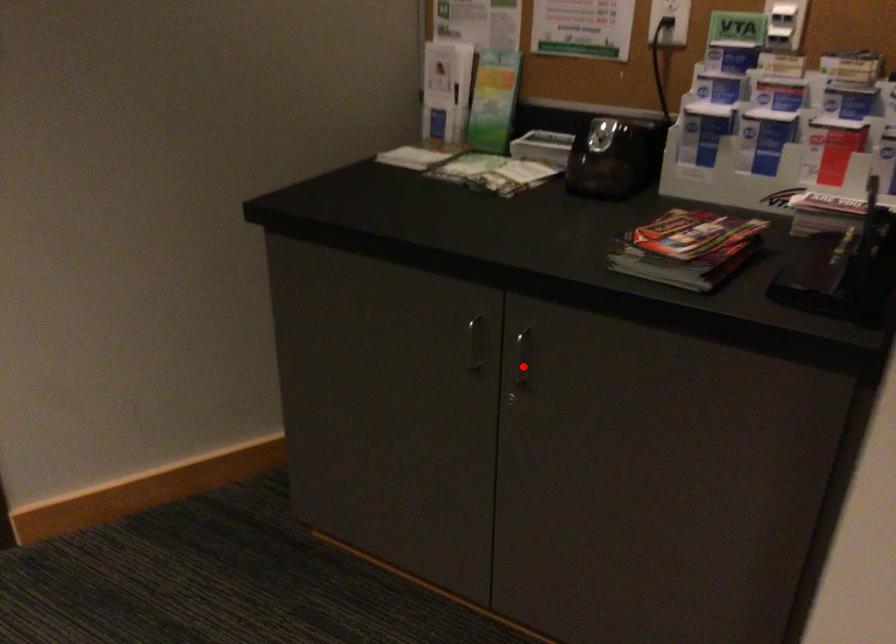
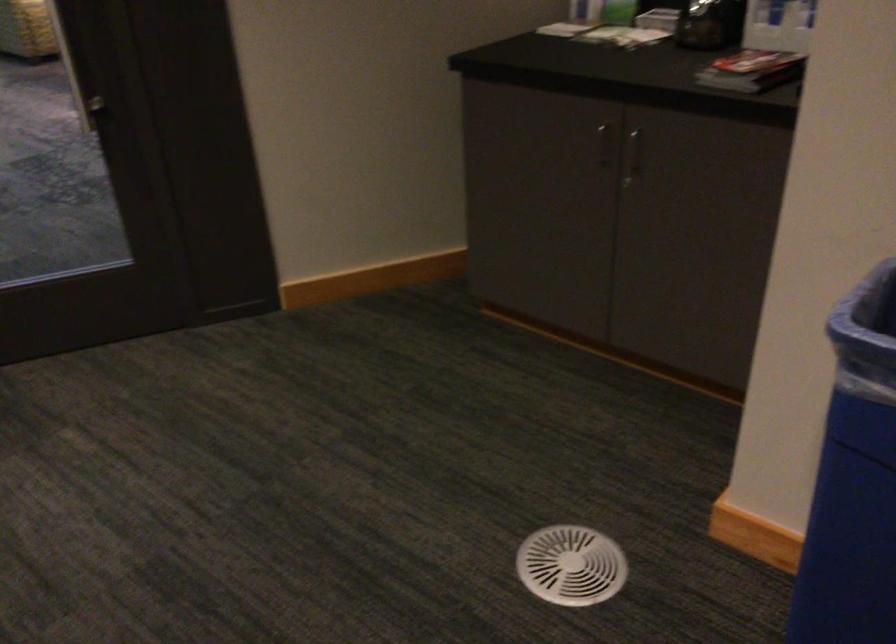
Question: A red point is marked in image1. In image2, is the corresponding 3D point closer to the camera or farther? Reply with the corresponding letter.

Choices:
 (A) The corresponding 3D point is closer.
 (B) The corresponding 3D point is farther.

Answer: (B)